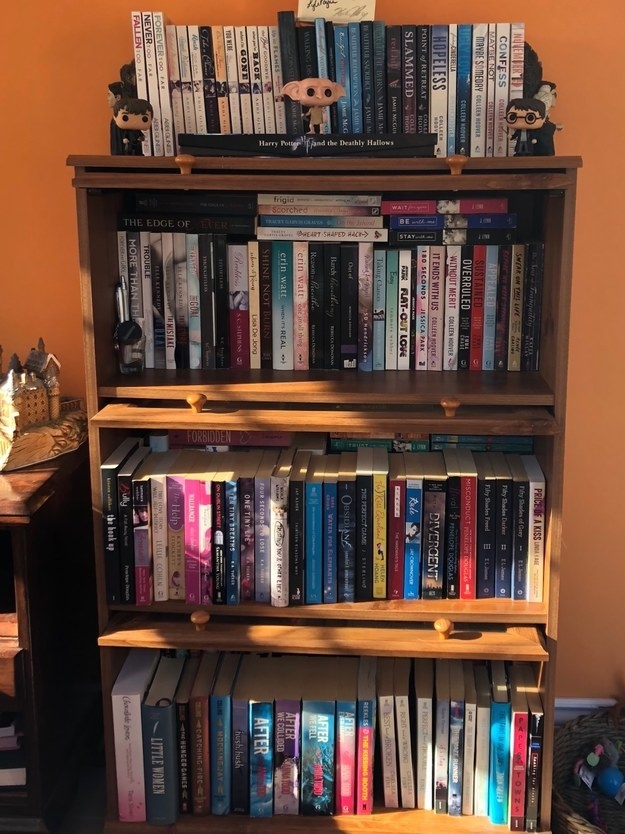
This screenshot has height=834, width=625. Find the location of `knobs`. knobs is located at coordinates (458, 173), (185, 161), (195, 399), (447, 414), (446, 624), (199, 625).